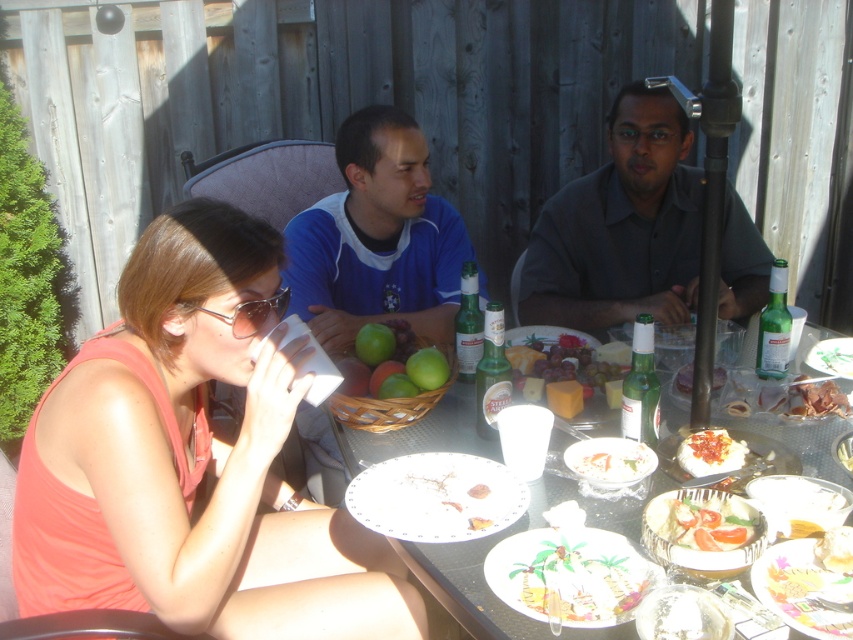
Consider the image. You are at a backyard gathering and want to place a small decorative item on the table. You have a pink fabric tank top at left and a green glass bottle at center. Which object can you use as a base to place your item without it being too unstable?

The pink fabric tank top at left is bigger than the green glass bottle at center, so placing the item on the pink fabric tank top at left would provide a more stable base due to its larger surface area.